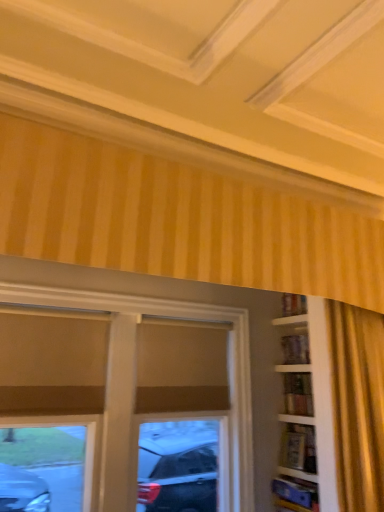
Where is `matte brown window at center`? The image size is (384, 512). matte brown window at center is located at coordinates (183, 319).

Does matte brown window at center have a greater height compared to wooden bookshelf at right, which appears as the 2th shelf when viewed from the top?

Yes.

Who is smaller, matte brown window at center or wooden bookshelf at right, marked as the first shelf in a bottom-to-top arrangement?

Smaller between the two is wooden bookshelf at right, marked as the first shelf in a bottom-to-top arrangement.

Visually, is matte brown window at center positioned to the left or to the right of wooden bookshelf at right, marked as the first shelf in a bottom-to-top arrangement?

Answer: Based on their positions, matte brown window at center is located to the left of wooden bookshelf at right, marked as the first shelf in a bottom-to-top arrangement.

Is matte brown window at center located outside wooden bookshelf at right, which appears as the 2th shelf when viewed from the top?

That's correct, matte brown window at center is outside of wooden bookshelf at right, which appears as the 2th shelf when viewed from the top.

Between point (292, 391) and point (245, 389), which one is positioned in front?

The point (245, 389) is closer.

Based on the photo, how many degrees apart are the facing directions of wooden bookshelf at right, which appears as the 2th shelf when ordered from the bottom, and matte brown window at center?

They differ by 89.9 degrees in their facing directions.

Consider the image. Would you say wooden bookshelf at right, which is counted as the 1th shelf, starting from the top, is outside matte brown window at center?

wooden bookshelf at right, which is counted as the 1th shelf, starting from the top, lies outside matte brown window at center's area.

From a real-world perspective, is wooden bookshelf at right, which appears as the 2th shelf when ordered from the bottom, located higher than matte brown window at center?

Yes, from a real-world perspective, wooden bookshelf at right, which appears as the 2th shelf when ordered from the bottom, is over matte brown window at center

Is wooden bookshelf at right, marked as the first shelf in a bottom-to-top arrangement, turned away from wooden bookshelf at right, which is counted as the 1th shelf, starting from the top?

No, wooden bookshelf at right, marked as the first shelf in a bottom-to-top arrangement, is not facing the opposite direction of wooden bookshelf at right, which is counted as the 1th shelf, starting from the top.

Considering the relative sizes of wooden bookshelf at right, marked as the first shelf in a bottom-to-top arrangement, and wooden bookshelf at right, which is counted as the 1th shelf, starting from the top, in the image provided, is wooden bookshelf at right, marked as the first shelf in a bottom-to-top arrangement, smaller than wooden bookshelf at right, which is counted as the 1th shelf, starting from the top,?

No.

From a real-world perspective, is wooden bookshelf at right, marked as the first shelf in a bottom-to-top arrangement, on wooden bookshelf at right, which is counted as the 1th shelf, starting from the top?

Incorrect, from a real-world perspective, wooden bookshelf at right, marked as the first shelf in a bottom-to-top arrangement, is lower than wooden bookshelf at right, which is counted as the 1th shelf, starting from the top.

From the image's perspective, is wooden bookshelf at right, which appears as the 2th shelf when viewed from the top, above or below matte brown window at center?

wooden bookshelf at right, which appears as the 2th shelf when viewed from the top, is situated lower than matte brown window at center in the image.

From a real-world perspective, between wooden bookshelf at right, marked as the first shelf in a bottom-to-top arrangement, and matte brown window at center, who is vertically higher?

matte brown window at center, from a real-world perspective.

From the picture: Measure the distance between wooden bookshelf at right, which appears as the 2th shelf when viewed from the top, and matte brown window at center.

The distance of wooden bookshelf at right, which appears as the 2th shelf when viewed from the top, from matte brown window at center is 23.08 inches.

Is wooden bookshelf at right, marked as the first shelf in a bottom-to-top arrangement, not close to matte brown window at center?

No, there isn't a large distance between wooden bookshelf at right, marked as the first shelf in a bottom-to-top arrangement, and matte brown window at center.

Who is more distant, wooden bookshelf at right, which is counted as the 1th shelf, starting from the top, or wooden bookshelf at right, marked as the first shelf in a bottom-to-top arrangement?

wooden bookshelf at right, which is counted as the 1th shelf, starting from the top, is further from the camera.

Considering the sizes of objects wooden bookshelf at right, which is counted as the 1th shelf, starting from the top, and wooden bookshelf at right, which appears as the 2th shelf when viewed from the top, in the image provided, who is smaller, wooden bookshelf at right, which is counted as the 1th shelf, starting from the top, or wooden bookshelf at right, which appears as the 2th shelf when viewed from the top,?

wooden bookshelf at right, which is counted as the 1th shelf, starting from the top.

From a real-world perspective, which is physically below, wooden bookshelf at right, which appears as the 2th shelf when ordered from the bottom, or wooden bookshelf at right, which appears as the 2th shelf when viewed from the top?

In real-world perspective, wooden bookshelf at right, which appears as the 2th shelf when viewed from the top, is lower.

From the image's perspective, is wooden bookshelf at right, which is counted as the 1th shelf, starting from the top, over wooden bookshelf at right, which appears as the 2th shelf when viewed from the top?

Correct, wooden bookshelf at right, which is counted as the 1th shelf, starting from the top, appears higher than wooden bookshelf at right, which appears as the 2th shelf when viewed from the top, in the image.

Is there a large distance between matte brown window at center and wooden bookshelf at right, which is counted as the 1th shelf, starting from the top?

No, there isn't a large distance between matte brown window at center and wooden bookshelf at right, which is counted as the 1th shelf, starting from the top.

Considering the points (207, 310) and (306, 410), which point is behind, point (207, 310) or point (306, 410)?

Positioned behind is point (306, 410).

Would you say matte brown window at center contains wooden bookshelf at right, which appears as the 2th shelf when ordered from the bottom?

No.

The height and width of the screenshot is (512, 384). I want to click on window in front of the wooden bookshelf at right, which is counted as the 1th shelf, starting from the top, so click(x=183, y=319).

This screenshot has width=384, height=512. What are the coordinates of `window on the left of the wooden bookshelf at right, which appears as the 2th shelf when viewed from the top` in the screenshot? It's located at (183, 319).

This screenshot has height=512, width=384. There is a matte brown window at center. Identify the location of the 1st shelf below it (from the image's perspective). (298, 393).

Which object lies further to the anchor point matte brown window at center, wooden bookshelf at right, marked as the first shelf in a bottom-to-top arrangement, or wooden bookshelf at right, which is counted as the 1th shelf, starting from the top?

Based on the image, wooden bookshelf at right, marked as the first shelf in a bottom-to-top arrangement, appears to be further to matte brown window at center.

Which object lies nearer to the anchor point matte brown window at center, wooden bookshelf at right, which is counted as the 1th shelf, starting from the top, or wooden bookshelf at right, marked as the first shelf in a bottom-to-top arrangement?

Among the two, wooden bookshelf at right, which is counted as the 1th shelf, starting from the top, is located nearer to matte brown window at center.

When comparing their distances from wooden bookshelf at right, marked as the first shelf in a bottom-to-top arrangement, does wooden bookshelf at right, which is counted as the 1th shelf, starting from the top, or matte brown window at center seem further?

matte brown window at center is positioned further to the anchor wooden bookshelf at right, marked as the first shelf in a bottom-to-top arrangement.

When comparing their distances from wooden bookshelf at right, which is counted as the 1th shelf, starting from the top, does wooden bookshelf at right, which appears as the 2th shelf when viewed from the top, or matte brown window at center seem further?

matte brown window at center lies further to wooden bookshelf at right, which is counted as the 1th shelf, starting from the top, than the other object.

From the picture: Which object lies nearer to the anchor point wooden bookshelf at right, which is counted as the 1th shelf, starting from the top, matte brown window at center or wooden bookshelf at right, which appears as the 2th shelf when viewed from the top?

Among the two, wooden bookshelf at right, which appears as the 2th shelf when viewed from the top, is located nearer to wooden bookshelf at right, which is counted as the 1th shelf, starting from the top.

Based on their spatial positions, is matte brown window at center or wooden bookshelf at right, which is counted as the 1th shelf, starting from the top, closer to wooden bookshelf at right, which appears as the 2th shelf when viewed from the top?

Among the two, wooden bookshelf at right, which is counted as the 1th shelf, starting from the top, is located nearer to wooden bookshelf at right, which appears as the 2th shelf when viewed from the top.

At what (x,y) coordinates should I click in order to perform the action: click on shelf located between matte brown window at center and wooden bookshelf at right, which is counted as the 1th shelf, starting from the top, in the left-right direction. Please return your answer as a coordinate pair (x, y). The height and width of the screenshot is (512, 384). Looking at the image, I should click on (296, 492).